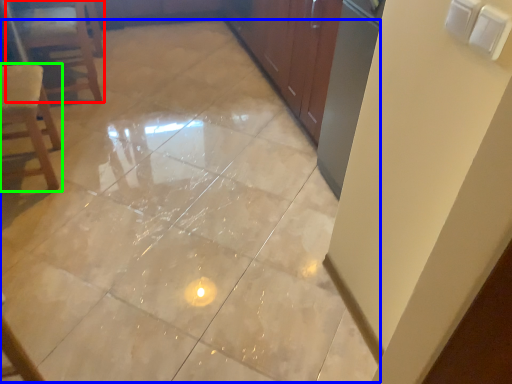
Question: Estimate the real-world distances between objects in this image. Which object is closer to furniture (highlighted by a red box), ceramic tile (highlighted by a blue box) or chair (highlighted by a green box)?

Choices:
 (A) ceramic tile
 (B) chair

Answer: (B)